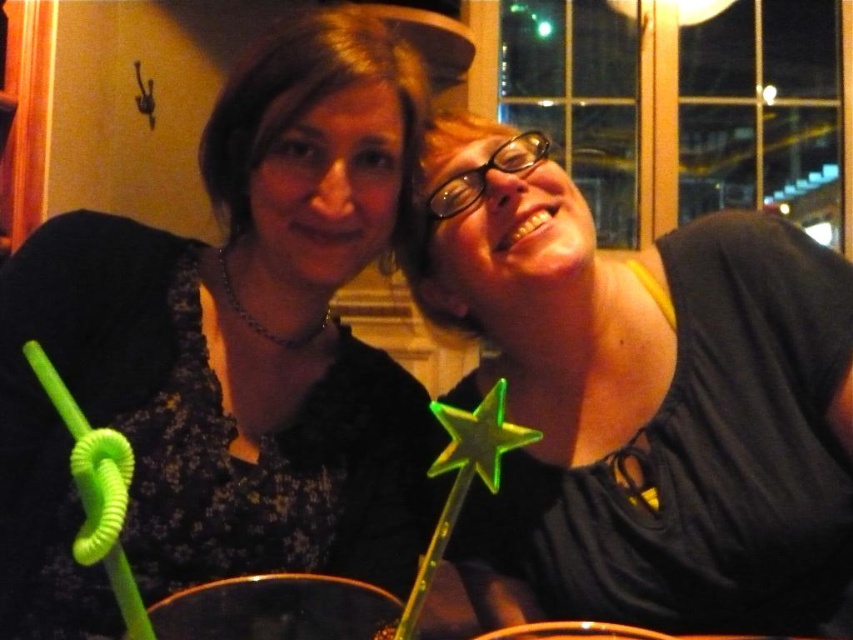
Question: Observing the image, what is the correct spatial positioning of green plastic wand at upper right in reference to translucent glass beverage at lower center?

Choices:
 (A) above
 (B) below

Answer: (A)

Question: Which point is farther to the camera?

Choices:
 (A) green plastic wand at upper right
 (B) green plastic star at center
 (C) matte black dress at left
 (D) translucent glass beverage at lower center

Answer: (A)

Question: Is matte black dress at left to the right of green plastic wand at upper right from the viewer's perspective?

Choices:
 (A) no
 (B) yes

Answer: (A)

Question: Can you confirm if green plastic wand at upper right is positioned to the right of translucent glass beverage at lower center?

Choices:
 (A) no
 (B) yes

Answer: (B)

Question: Estimate the real-world distances between objects in this image. Which object is closer to the green plastic star at center?

Choices:
 (A) green plastic wand at upper right
 (B) translucent glass beverage at lower center

Answer: (A)

Question: Which of the following is the farthest from the observer?

Choices:
 (A) click(27, 435)
 (B) click(611, 520)
 (C) click(374, 604)

Answer: (B)